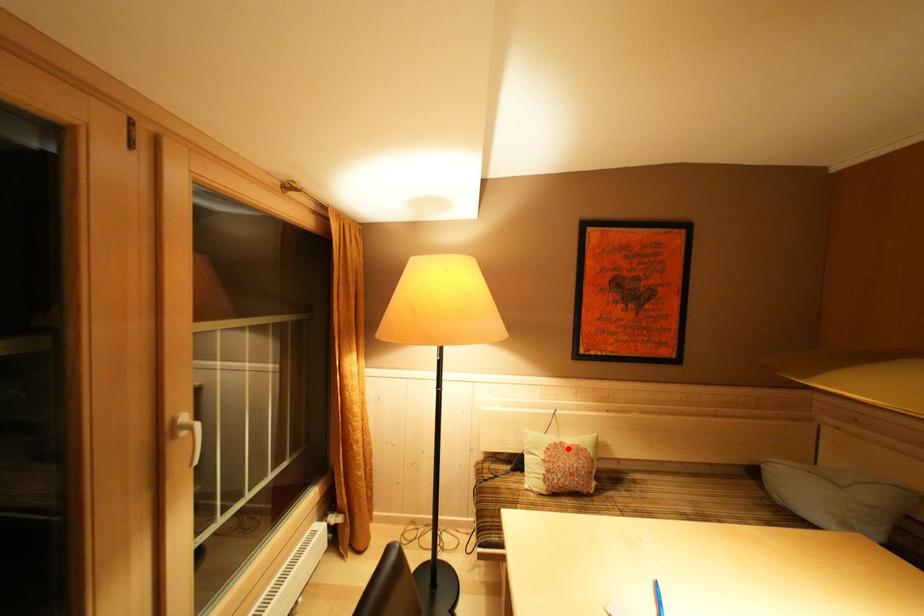
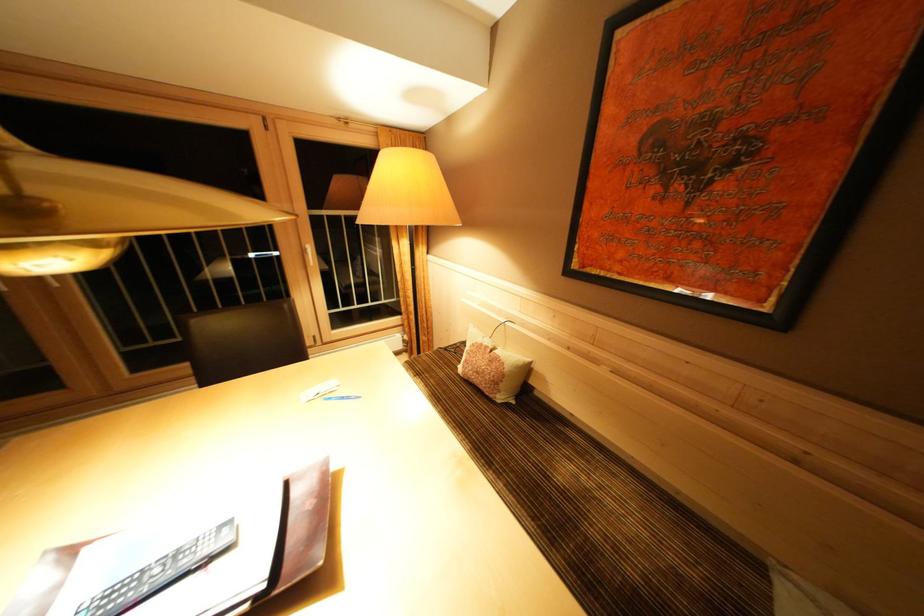
The point at the highlighted location is marked in the first image. Where is the corresponding point in the second image?

(493, 352)